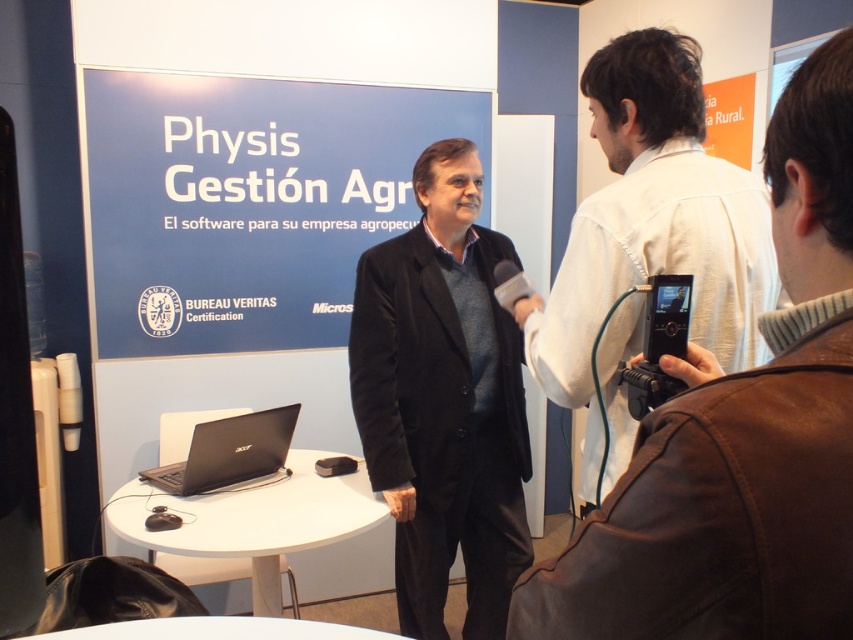
Question: Which is farther from the black velvet blazer at center?

Choices:
 (A) black matte laptop at lower left
 (B) white shirt at center

Answer: (B)

Question: Is black velvet blazer at center to the right of black matte laptop at lower left from the viewer's perspective?

Choices:
 (A) yes
 (B) no

Answer: (A)

Question: Which point appears closest to the camera in this image?

Choices:
 (A) (399, 620)
 (B) (701, 328)

Answer: (B)

Question: Does white shirt at center have a lesser width compared to black matte laptop at lower left?

Choices:
 (A) yes
 (B) no

Answer: (A)

Question: Which object is farther from the camera taking this photo?

Choices:
 (A) white shirt at center
 (B) black matte laptop at lower left
 (C) black velvet blazer at center

Answer: (C)

Question: Does black velvet blazer at center appear on the left side of black matte laptop at lower left?

Choices:
 (A) no
 (B) yes

Answer: (A)